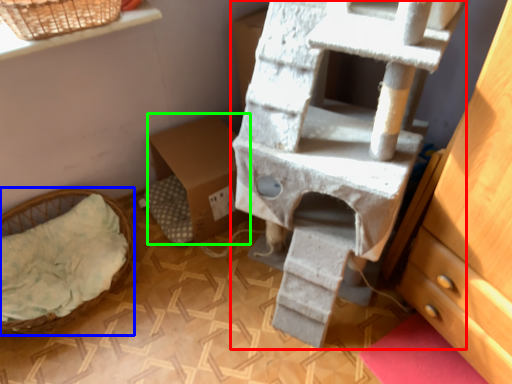
Question: Considering the real-world distances, which object is closest to bunk bed (highlighted by a red box)? furniture (highlighted by a blue box) or cardboard box (highlighted by a green box).

Choices:
 (A) furniture
 (B) cardboard box

Answer: (B)